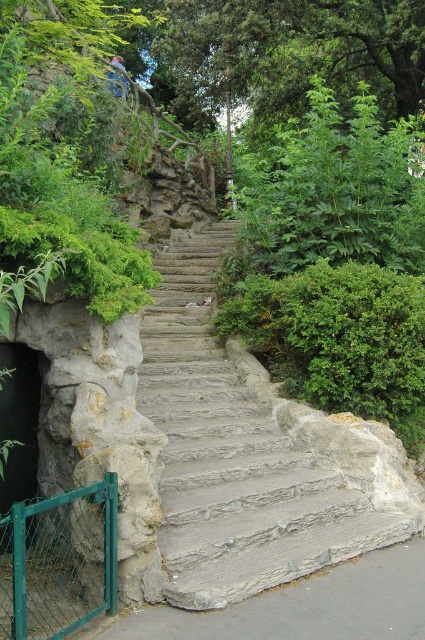
Question: Does gray stone stairs at center have a lesser width compared to dark gray stone entrance at left?

Choices:
 (A) no
 (B) yes

Answer: (A)

Question: Which point is farther from the camera taking this photo?

Choices:
 (A) (119, 83)
 (B) (139, 141)

Answer: (A)

Question: Can you confirm if gray stone stairs at center is positioned to the left of dark gray stone entrance at left?

Choices:
 (A) no
 (B) yes

Answer: (A)

Question: Based on their relative distances, which object is farther from the metallic silver skateboard at upper center?

Choices:
 (A) green leafy bush at upper left
 (B) dark gray stone entrance at left
 (C) gray stone stairs at center

Answer: (B)

Question: Is green leafy bush at upper left bigger than dark gray stone entrance at left?

Choices:
 (A) yes
 (B) no

Answer: (A)

Question: Which object is positioned closest to the metallic silver skateboard at upper center?

Choices:
 (A) gray stone stairs at center
 (B) green leafy bush at upper left

Answer: (B)